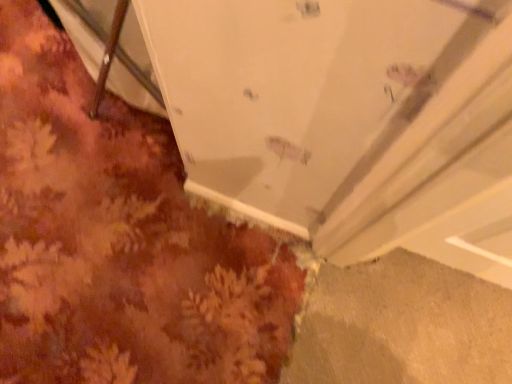
Find the location of `fluffy carpet at lower left`. fluffy carpet at lower left is located at coordinates (119, 241).

What do you see at coordinates (119, 241) in the screenshot?
I see `fluffy carpet at lower left` at bounding box center [119, 241].

Where is `fluffy carpet at lower left`? The width and height of the screenshot is (512, 384). fluffy carpet at lower left is located at coordinates (119, 241).